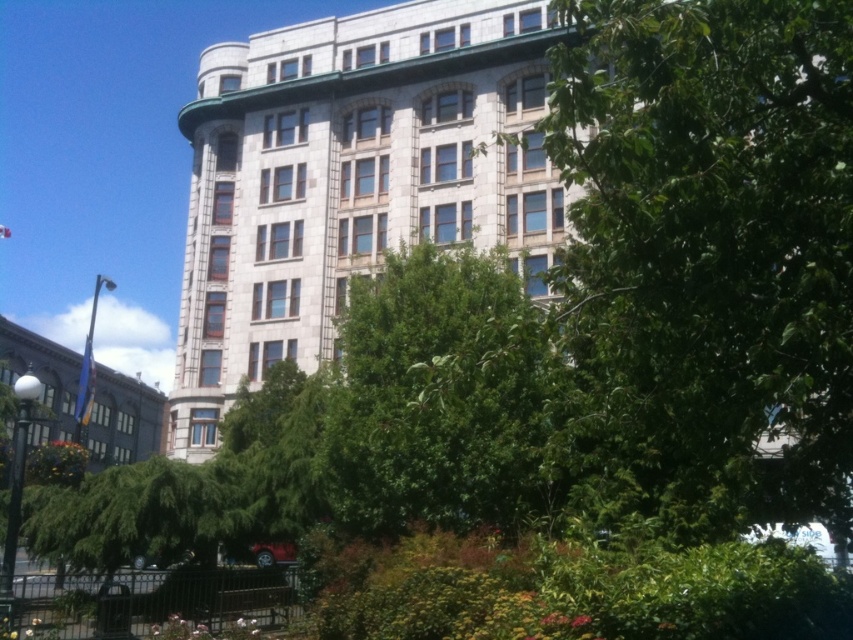
You are a landscape architect designing a garden around the stone building at center. Considering the green leafy tree at upper center, which of the two is smaller in size and should be placed closer to the building for better visibility?

The green leafy tree at upper center is smaller in size compared to the stone building at center, so it should be placed closer to the building for better visibility.

You are standing in front of the green leafy tree at upper center and the matte gray building at left. Which object would appear larger to you?

The green leafy tree at upper center would appear larger because it is closer to the viewer than the matte gray building at left.